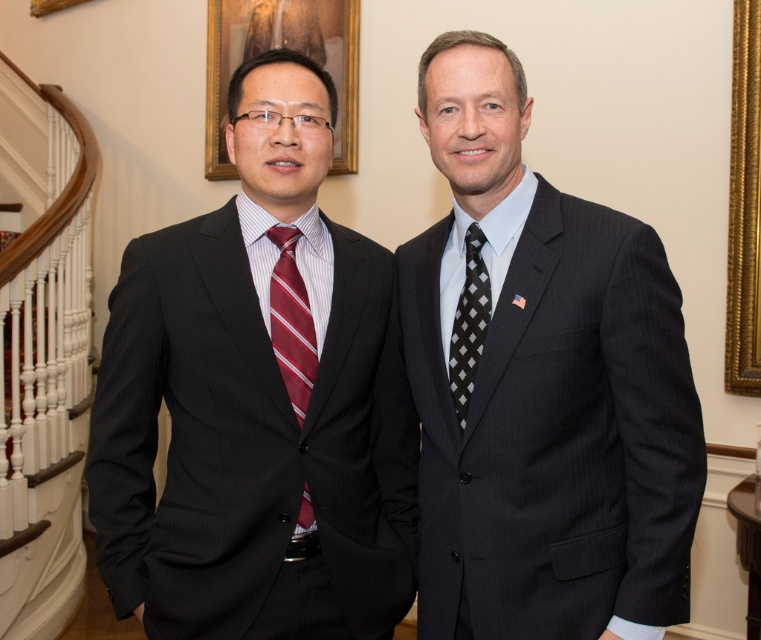
Does black pinstripe suit at left appear on the left side of matte gold picture frame at upper center?

No, black pinstripe suit at left is not to the left of matte gold picture frame at upper center.

Is point (161, 280) farther from viewer compared to point (317, 36)?

No, it is not.

What are the coordinates of `black pinstripe suit at left` in the screenshot? It's located at (247, 440).

Can you confirm if black pinstripe suit at right is positioned to the right of black checkered tie at right?

Correct, you'll find black pinstripe suit at right to the right of black checkered tie at right.

Is point (629, 252) in front of point (475, 228)?

Yes, it is.

Identify the location of black pinstripe suit at right. The width and height of the screenshot is (761, 640). (553, 426).

Who is positioned more to the left, black pinstripe suit at right or striped silk tie at left?

Positioned to the left is striped silk tie at left.

Does point (505, 305) come behind point (304, 513)?

No, it is not.

I want to click on black pinstripe suit at right, so [553, 426].